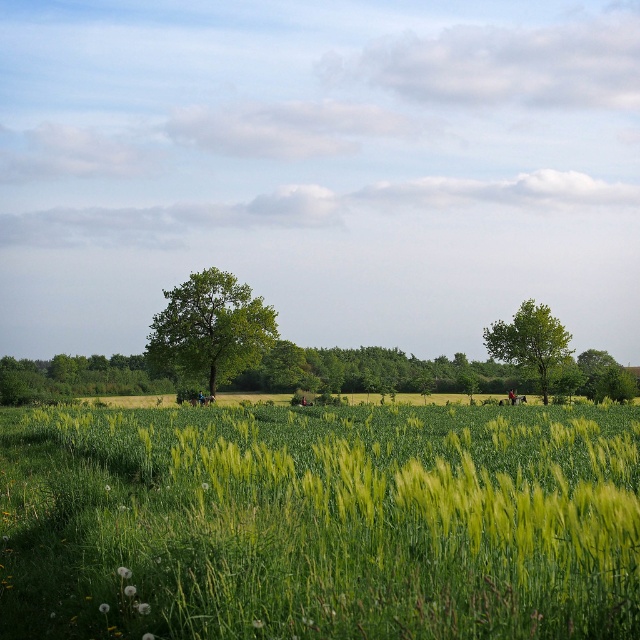
Question: Is green leafy tree at center further to camera compared to green leafy tree at right?

Choices:
 (A) no
 (B) yes

Answer: (A)

Question: Can you confirm if green leafy tree at center is smaller than green leafy tree at right?

Choices:
 (A) no
 (B) yes

Answer: (A)

Question: Which point is farther to the camera?

Choices:
 (A) green leafy tree at center
 (B) green grassy wheat field at center
 (C) green leafy tree at right

Answer: (C)

Question: Is green grassy wheat field at center thinner than green leafy tree at center?

Choices:
 (A) no
 (B) yes

Answer: (A)

Question: Considering the real-world distances, which object is closest to the green leafy tree at right?

Choices:
 (A) green leafy tree at center
 (B) green grassy wheat field at center

Answer: (A)

Question: Which of the following is the closest to the observer?

Choices:
 (A) green leafy tree at right
 (B) green grassy wheat field at center

Answer: (B)